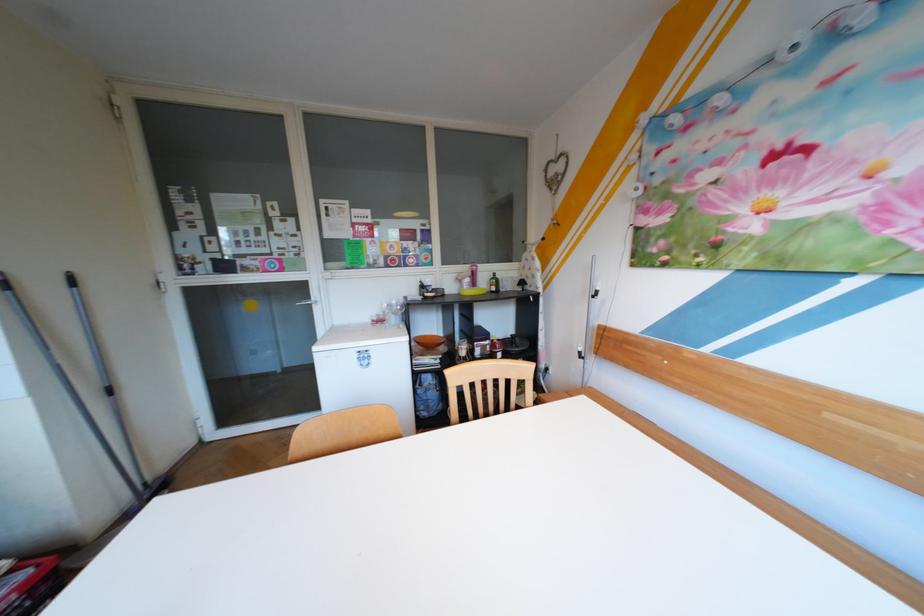
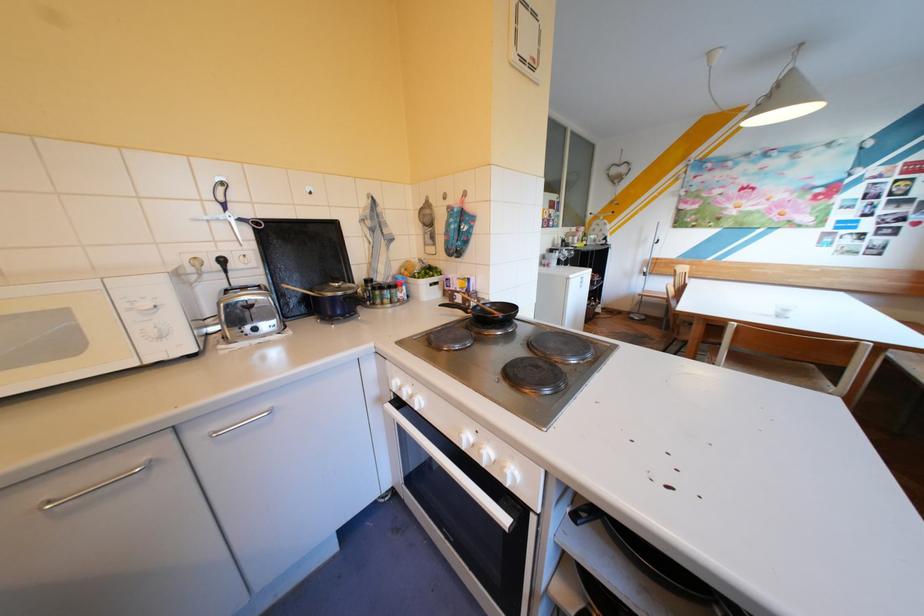
Question: I am providing you with two images of the same scene from different viewpoints. After the viewpoint changes to image2, which objects are now occluded?

Choices:
 (A) table port cover
 (B) blue oven mitts
 (C) red food can
 (D) white oven knob

Answer: (C)